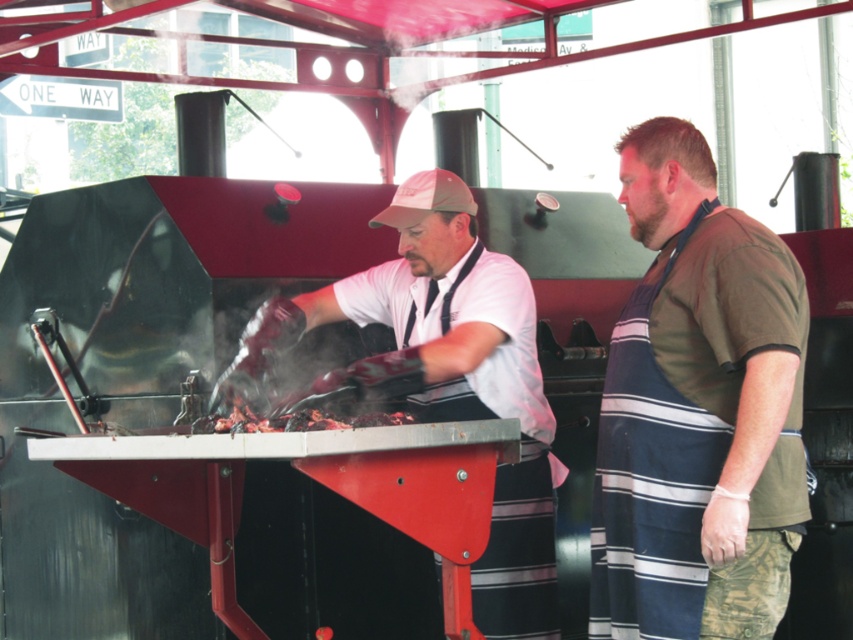
You are standing at the center of the image and want to reach the striped apron at right. Which direction should you move to get there?

The striped apron at right is located at point 0.642 on the x axis and 0.818 on the y axis. Since you are at the center, you should move to the right and upwards to reach it.